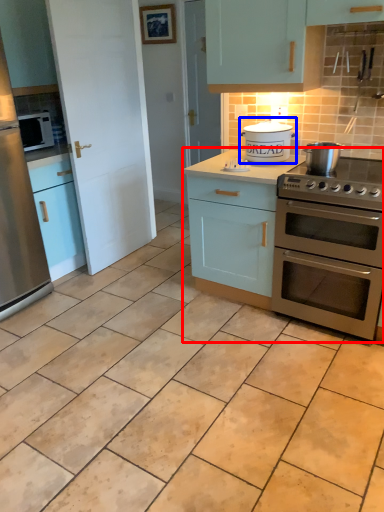
Question: Which object is further to the camera taking this photo, cabinetry (highlighted by a red box) or appliance (highlighted by a blue box)?

Choices:
 (A) cabinetry
 (B) appliance

Answer: (B)